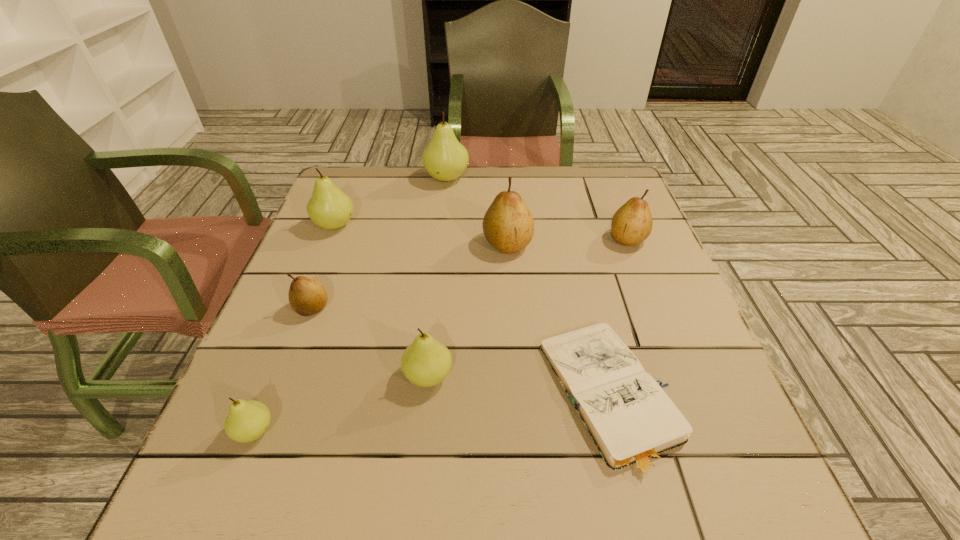
Locate an element on the screen. the fourth nearest object is located at coordinates (307, 296).

Locate an element on the screen. the nearest pear is located at coordinates (247, 421).

Where is `the smallest green pear`? the smallest green pear is located at coordinates (247, 421).

Locate an element on the screen. The width and height of the screenshot is (960, 540). the shortest object is located at coordinates (633, 423).

Locate an element on the screen. The image size is (960, 540). free space located on the left of the biggest green pear is located at coordinates (380, 178).

At what (x,y) coordinates should I click in order to perform the action: click on free space located on the front of the second biggest green pear. Please return your answer as a coordinate pair (x, y). Looking at the image, I should click on (278, 364).

The width and height of the screenshot is (960, 540). In order to click on free point located 0.330m on the left of the second pear from right to left in this screenshot , I will do `click(348, 244)`.

Identify the location of free space located 0.060m on the left of the third biggest green pear. This screenshot has width=960, height=540. (372, 376).

The width and height of the screenshot is (960, 540). What are the coordinates of `free space located on the left of the second smallest brown pear` in the screenshot? It's located at (480, 239).

Locate an element on the screen. free region located on the right of the fifth farthest pear is located at coordinates (468, 308).